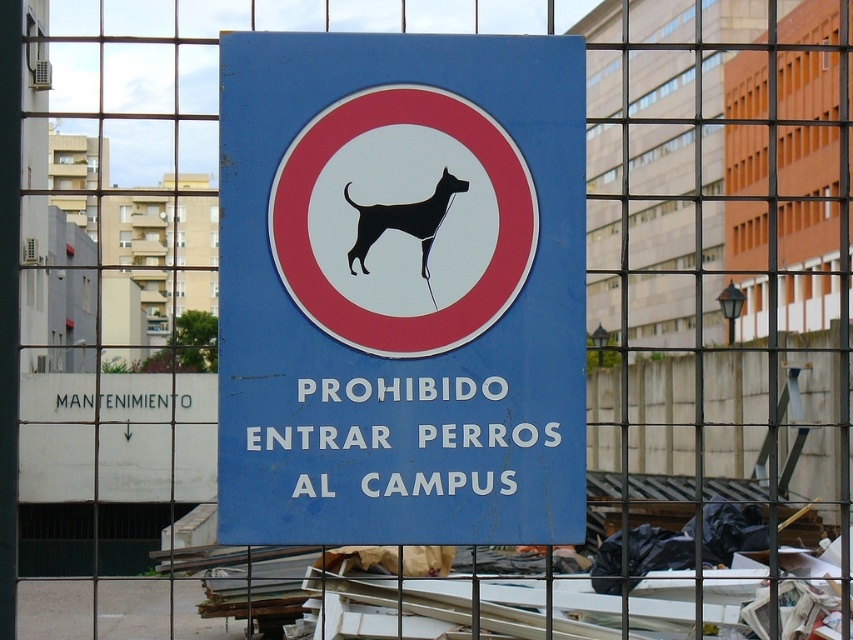
Question: Is the position of blue plastic sign at center less distant than that of black silhouette dog at center?

Choices:
 (A) yes
 (B) no

Answer: (A)

Question: Does blue plastic sign at center have a greater width compared to black silhouette dog at center?

Choices:
 (A) yes
 (B) no

Answer: (A)

Question: Among these objects, which one is nearest to the camera?

Choices:
 (A) black silhouette dog at center
 (B) blue plastic sign at center

Answer: (B)

Question: Which point is closer to the camera?

Choices:
 (A) (399, 220)
 (B) (556, 429)

Answer: (A)

Question: Is blue plastic sign at center below black silhouette dog at center?

Choices:
 (A) yes
 (B) no

Answer: (A)